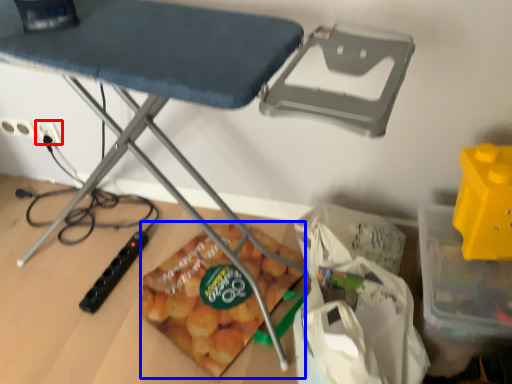
Question: Which object appears closest to the camera in this image, electric outlet (highlighted by a red box) or snack (highlighted by a blue box)?

Choices:
 (A) electric outlet
 (B) snack

Answer: (B)